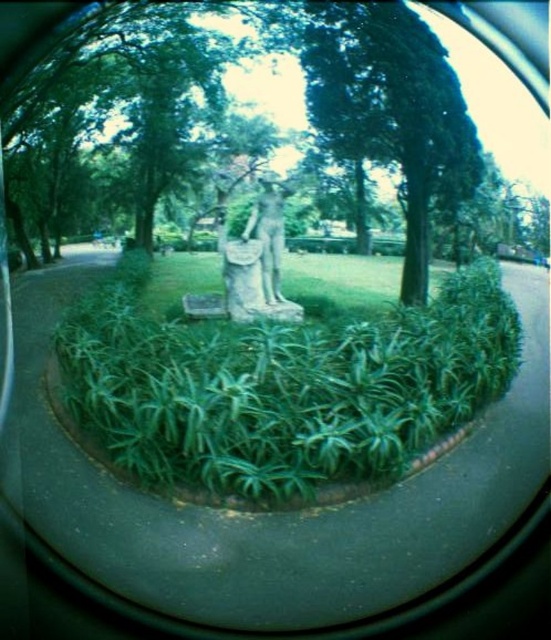
You are a gardener who needs to water the green leafy grass at center and the smooth stone statue at center. Since the statue is in the way, can you reach the grass easily?

The green leafy grass at center is located below the smooth stone statue at center, so you can easily access it by moving around the statue or from the sides.

You are standing at point (x=233, y=264) in the image. The statue at center is 18.23 feet away from you. If you want to walk directly to the statue, which direction should you go?

Since you are at point (x=233, y=264) and the statue at center is 18.23 feet away, you should walk towards the center of the image to reach the statue.